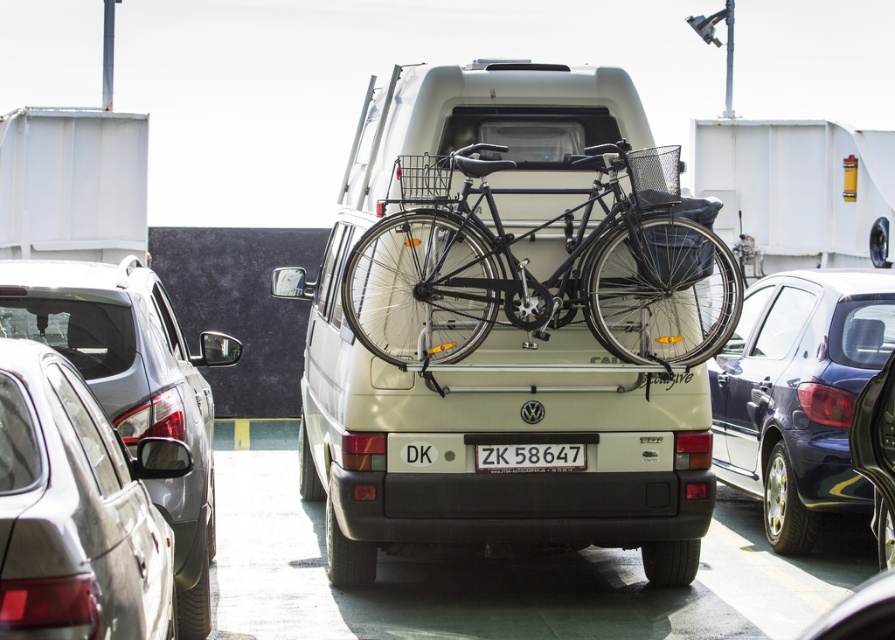
Does satin silver car at left have a lesser height compared to black plastic license plate at center?

No, satin silver car at left is not shorter than black plastic license plate at center.

Who is more distant from viewer, (4, 561) or (575, 452)?

Positioned behind is point (575, 452).

The image size is (895, 640). What are the coordinates of `satin silver car at left` in the screenshot? It's located at (72, 513).

Is point (665, 298) farther from viewer compared to point (72, 470)?

That is True.

Is shiny black bicycle at center bigger than satin silver car at left?

Yes.

What do you see at coordinates (550, 275) in the screenshot?
I see `shiny black bicycle at center` at bounding box center [550, 275].

What are the coordinates of `shiny black bicycle at center` in the screenshot? It's located at (550, 275).

Who is lower down, shiny black car at right or black plastic license plate at center?

black plastic license plate at center

Which is in front, point (884, 529) or point (490, 449)?

Point (884, 529) is more forward.

What do you see at coordinates (876, 452) in the screenshot?
I see `shiny black car at right` at bounding box center [876, 452].

Identify the location of shiny black car at right. The width and height of the screenshot is (895, 640). 876,452.